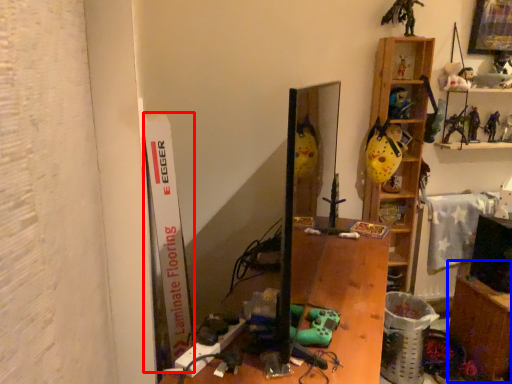
Question: Which point is closer to the camera, bulletin board (highlighted by a red box) or table (highlighted by a blue box)?

Choices:
 (A) bulletin board
 (B) table

Answer: (A)